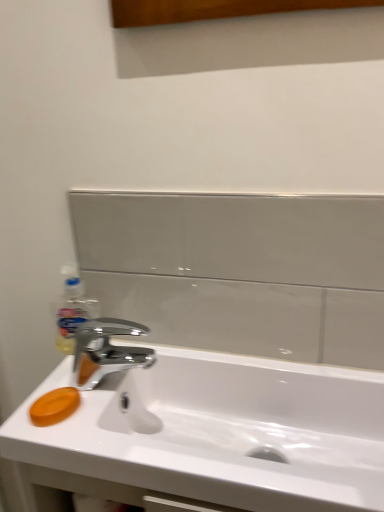
Find the location of a particular element. This screenshot has height=512, width=384. vacant area that lies to the right of orange matte soap at lower left is located at coordinates (142, 437).